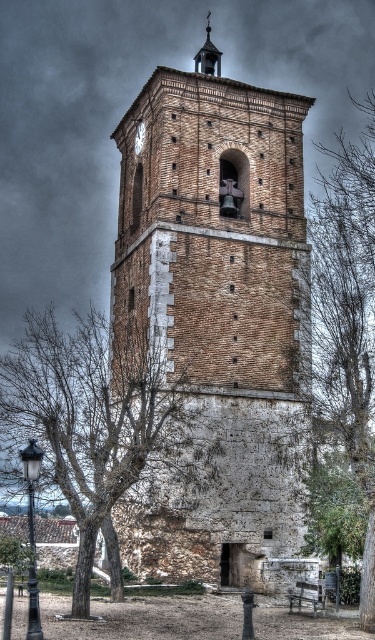
Question: Among these points, which one is nearest to the camera?

Choices:
 (A) (139, 138)
 (B) (360, 396)
 (C) (85, 573)

Answer: (C)

Question: Is green leafy tree at right positioned in front of metallic clock at upper center?

Choices:
 (A) no
 (B) yes

Answer: (B)

Question: Among these points, which one is nearest to the camera?

Choices:
 (A) (150, 342)
 (B) (142, 138)
 (C) (151, 278)
 (D) (336, 344)

Answer: (A)

Question: Which object is closer to the camera taking this photo?

Choices:
 (A) metallic clock at upper center
 (B) bare branches at center
 (C) green leafy tree at right

Answer: (B)

Question: Does brown brick tower at center appear over bare branches at center?

Choices:
 (A) yes
 (B) no

Answer: (A)

Question: Can you confirm if brown brick tower at center is wider than bare branches at center?

Choices:
 (A) no
 (B) yes

Answer: (A)